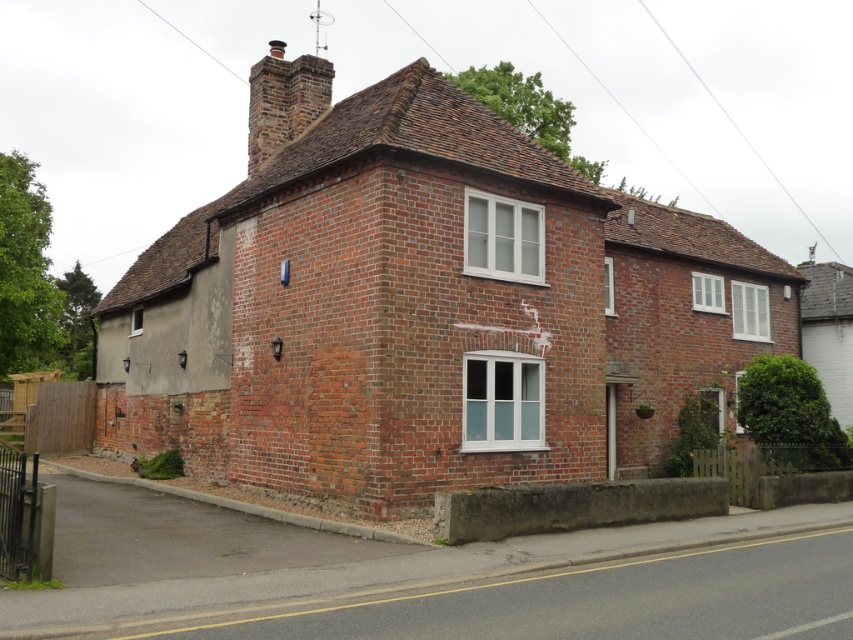
Question: From the image, what is the correct spatial relationship of red brick house at center in relation to gray concrete chimney at upper right?

Choices:
 (A) left
 (B) right

Answer: (A)

Question: From the image, what is the correct spatial relationship of red brick house at center in relation to brick chimney at upper center?

Choices:
 (A) right
 (B) left

Answer: (A)

Question: Which point is farther to the camera?

Choices:
 (A) gray concrete chimney at upper right
 (B) brick chimney at upper center

Answer: (A)

Question: Where is red brick house at center located in relation to brick chimney at upper center in the image?

Choices:
 (A) below
 (B) above

Answer: (A)

Question: Estimate the real-world distances between objects in this image. Which object is closer to the brick chimney at upper center?

Choices:
 (A) red brick house at center
 (B) gray concrete chimney at upper right

Answer: (A)

Question: Which object is the farthest from the gray concrete chimney at upper right?

Choices:
 (A) brick chimney at upper center
 (B) red brick house at center

Answer: (A)